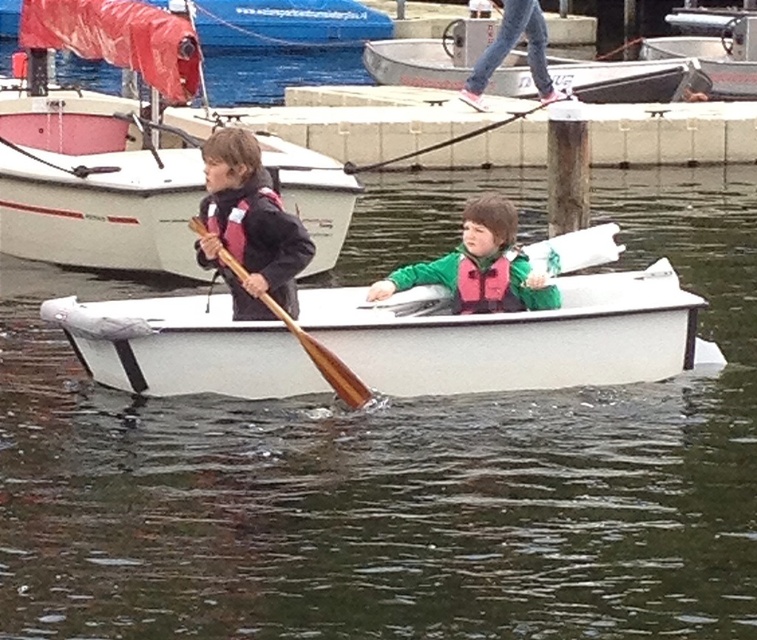
Between white plastic canoe at center and pink fabric life jacket at left, which one has more height?

white plastic canoe at center is taller.

Can you confirm if white plastic canoe at center is bigger than pink fabric life jacket at left?

Indeed, white plastic canoe at center has a larger size compared to pink fabric life jacket at left.

Is point (260, 387) positioned after point (206, 262)?

No.

At what (x,y) coordinates should I click in order to perform the action: click on white plastic canoe at center. Please return your answer as a coordinate pair (x, y). The width and height of the screenshot is (757, 640). Looking at the image, I should click on (516, 336).

Is white plastic boat at center in front of matte black life vest at left?

No.

Is point (67, 154) positioned before point (231, 148)?

No, it is not.

This screenshot has width=757, height=640. I want to click on white plastic boat at center, so pyautogui.click(x=97, y=182).

Is brushed metal boat at upper center thinner than pink fabric life jacket at left?

Incorrect, brushed metal boat at upper center's width is not less than pink fabric life jacket at left's.

Is brushed metal boat at upper center further to camera compared to pink fabric life jacket at left?

Yes, brushed metal boat at upper center is behind pink fabric life jacket at left.

Find the location of a particular element. This screenshot has height=640, width=757. brushed metal boat at upper center is located at coordinates (287, 24).

This screenshot has width=757, height=640. In order to click on brushed metal boat at upper center in this screenshot , I will do `click(287, 24)`.